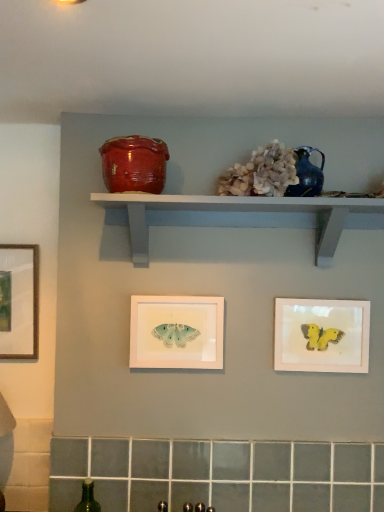
Question: Should I look upward or downward to see glossy ceramic jar at upper center?

Choices:
 (A) up
 (B) down

Answer: (A)

Question: Is matte pink picture frame at lower right, which ranks as the 2th picture frame in left-to-right order, positioned behind teal ceramic vase at upper center?

Choices:
 (A) no
 (B) yes

Answer: (B)

Question: Is matte pink picture frame at lower right, which ranks as the 2th picture frame in left-to-right order, not near teal ceramic vase at upper center?

Choices:
 (A) no
 (B) yes

Answer: (A)

Question: Does matte pink picture frame at lower right, which ranks as the first picture frame in right-to-left order, turn towards teal ceramic vase at upper center?

Choices:
 (A) yes
 (B) no

Answer: (B)

Question: Considering the relative sizes of matte pink picture frame at lower right, which ranks as the first picture frame in right-to-left order, and teal ceramic vase at upper center in the image provided, is matte pink picture frame at lower right, which ranks as the first picture frame in right-to-left order, shorter than teal ceramic vase at upper center?

Choices:
 (A) yes
 (B) no

Answer: (B)

Question: Are matte pink picture frame at lower right, which ranks as the 2th picture frame in left-to-right order, and teal ceramic vase at upper center beside each other?

Choices:
 (A) no
 (B) yes

Answer: (A)

Question: Does matte pink picture frame at lower right, which ranks as the 2th picture frame in left-to-right order, lie in front of teal ceramic vase at upper center?

Choices:
 (A) yes
 (B) no

Answer: (B)

Question: From the image's perspective, is white painted wood shelf at upper center on top of white matte butterfly at center, which is the first picture frame from left to right?

Choices:
 (A) no
 (B) yes

Answer: (B)

Question: Does white painted wood shelf at upper center have a smaller size compared to white matte butterfly at center, the 2th picture frame viewed from the right?

Choices:
 (A) yes
 (B) no

Answer: (B)

Question: Considering the relative sizes of white painted wood shelf at upper center and white matte butterfly at center, the 2th picture frame viewed from the right, in the image provided, is white painted wood shelf at upper center shorter than white matte butterfly at center, the 2th picture frame viewed from the right,?

Choices:
 (A) no
 (B) yes

Answer: (B)

Question: Does white painted wood shelf at upper center come behind white matte butterfly at center, which is the first picture frame from left to right?

Choices:
 (A) yes
 (B) no

Answer: (B)

Question: Can you confirm if white painted wood shelf at upper center is positioned to the right of white matte butterfly at center, the 2th picture frame viewed from the right?

Choices:
 (A) yes
 (B) no

Answer: (A)

Question: From a real-world perspective, is white painted wood shelf at upper center beneath white matte butterfly at center, which is the first picture frame from left to right?

Choices:
 (A) yes
 (B) no

Answer: (B)

Question: Is white matte butterfly at center, the 2th picture frame viewed from the right, further to the viewer compared to teal ceramic vase at upper center?

Choices:
 (A) yes
 (B) no

Answer: (A)